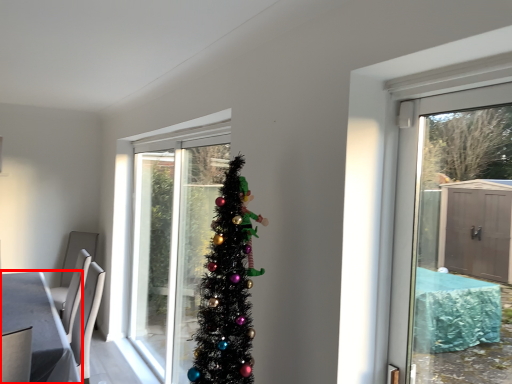
Question: From the image's perspective, where is table (annotated by the red box) located in relation to door in the image?

Choices:
 (A) below
 (B) above

Answer: (A)